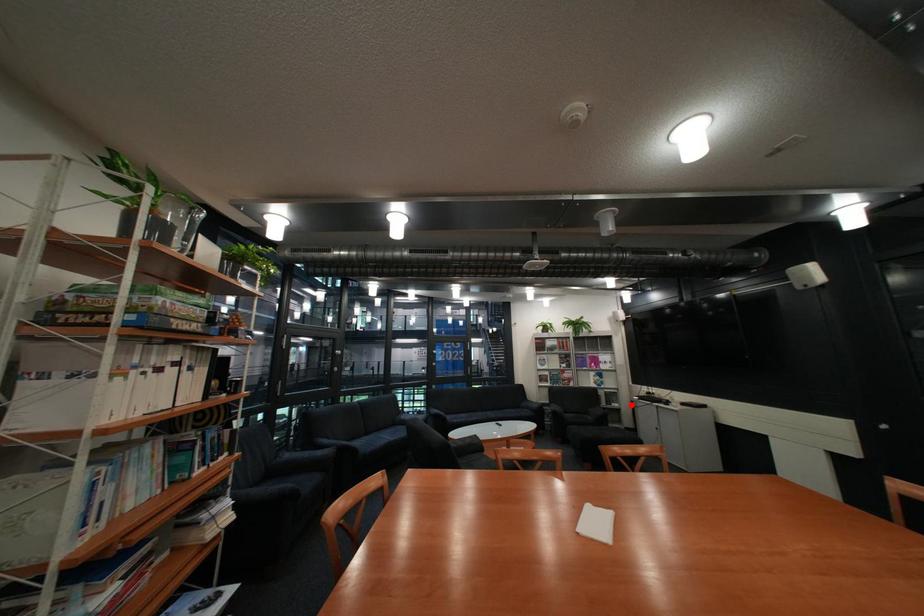
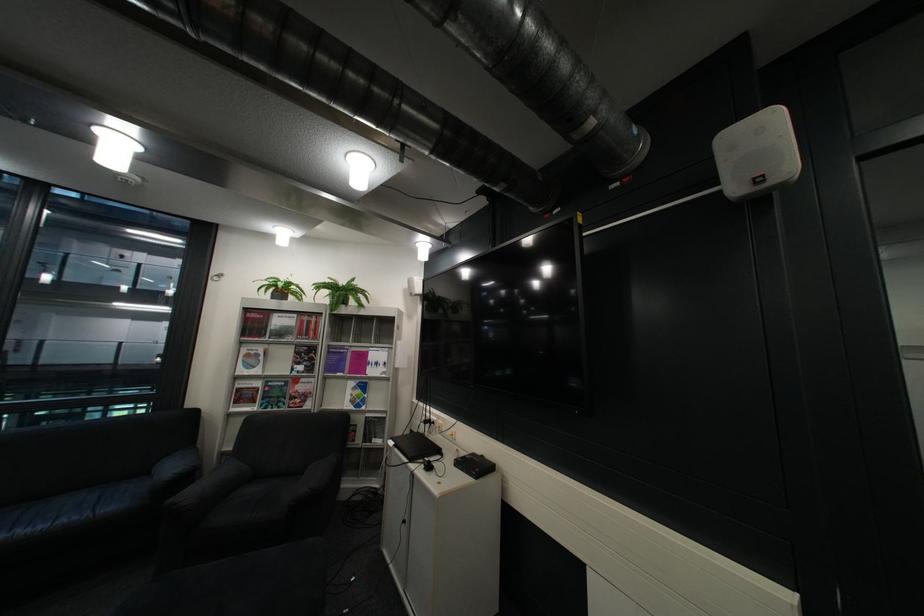
Question: I am providing you with two images of the same scene from different viewpoints. A red point is shown in image1. For the corresponding object point in image2, is it positioned nearer or farther from the camera?

Choices:
 (A) Nearer
 (B) Farther

Answer: (A)